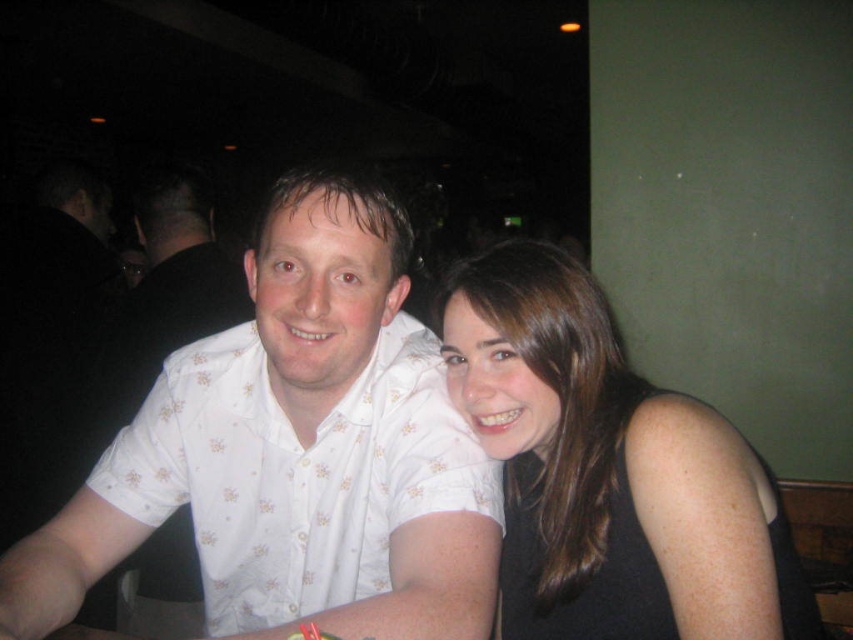
You are a photographer adjusting the focus of your camera. You notice two points in the image at coordinates point (212, 381) and point (498, 396). Which point is closer to the camera lens?

Point (212, 381) is further to the viewer than point (498, 396), so the point closer to the camera lens is point (498, 396).